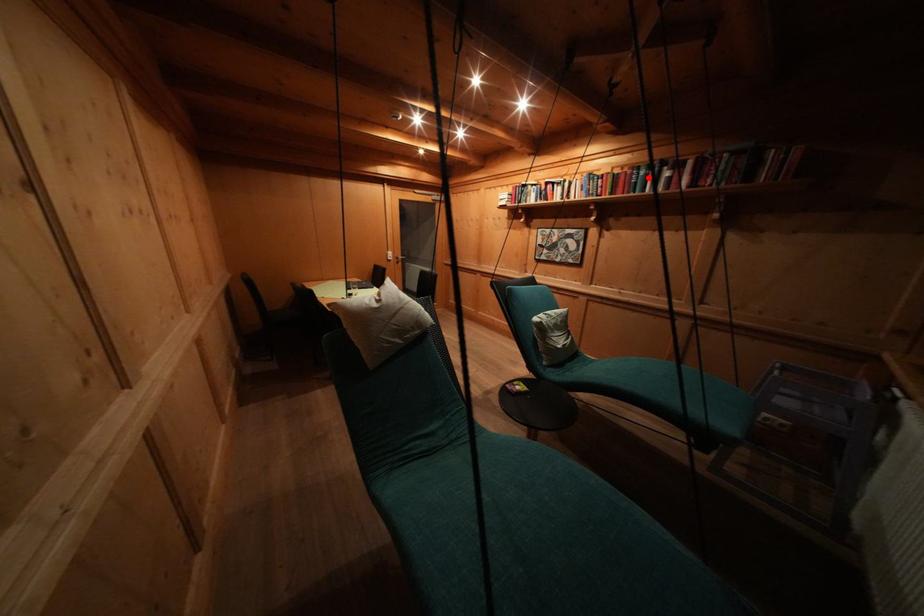
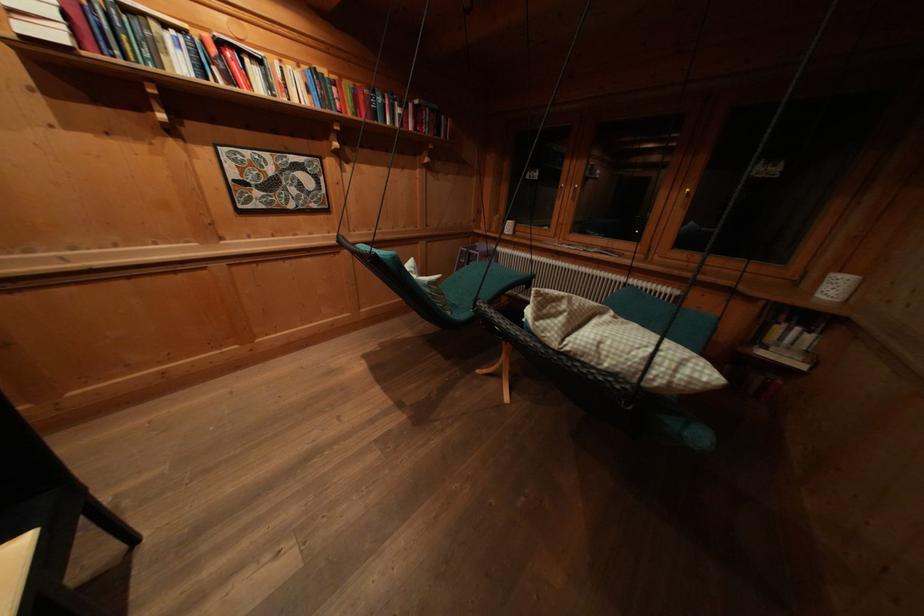
The point at the highlighted location is marked in the first image. Where is the corresponding point in the second image?

(385, 103)